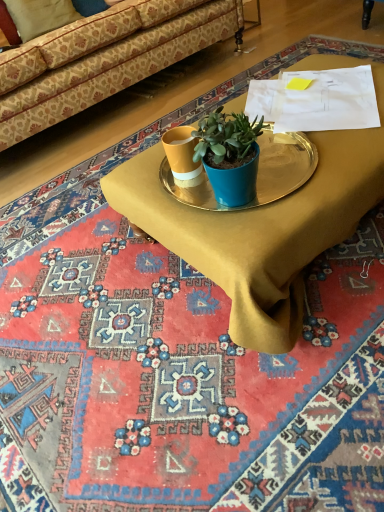
Question: Is metallic gold tray at center inside the boundaries of metallic gold tray at center, or outside?

Choices:
 (A) inside
 (B) outside

Answer: (B)

Question: From the image's perspective, is metallic gold tray at center above or below metallic gold tray at center?

Choices:
 (A) below
 (B) above

Answer: (A)

Question: Which object is positioned farthest from the metallic gold tray at center?

Choices:
 (A) beige fabric pillow at upper left
 (B) patterned fabric couch at upper left
 (C) metallic gold tray at center

Answer: (A)

Question: Considering the real-world distances, which object is farthest from the patterned fabric couch at upper left?

Choices:
 (A) beige fabric pillow at upper left
 (B) metallic gold tray at center
 (C) metallic gold tray at center

Answer: (C)